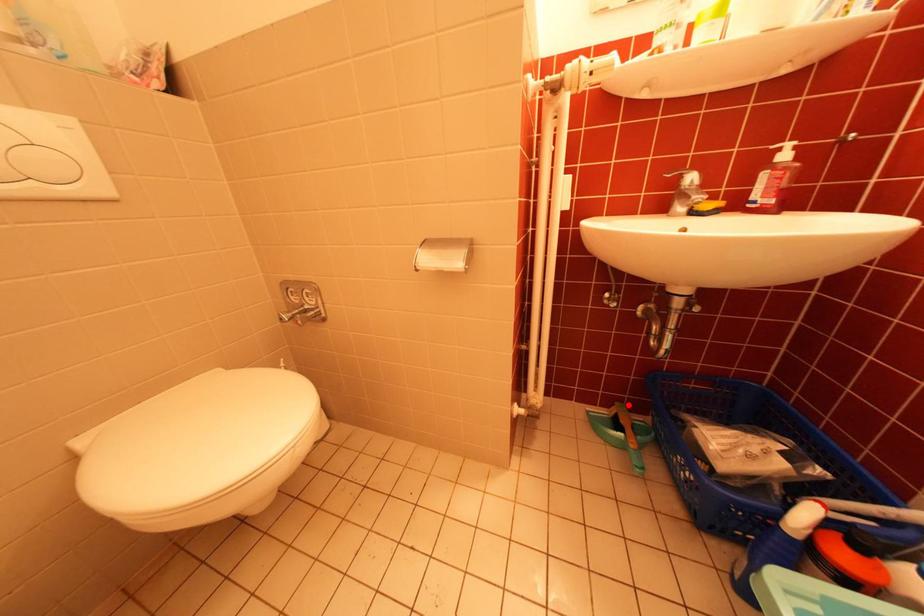
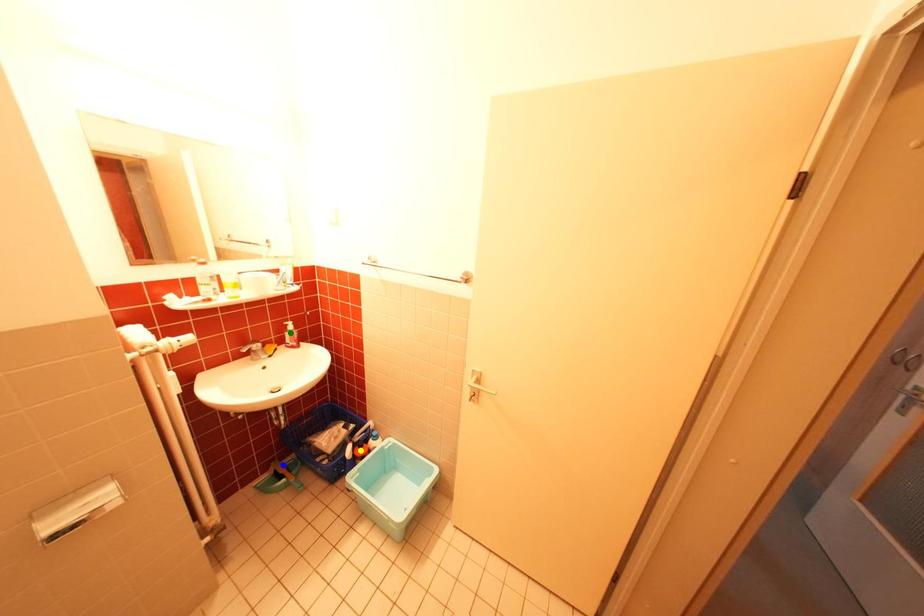
Question: I am providing you with two images of the same scene from different viewpoints. A red point is marked on the first image. You are given multiple points on the second image. Which spot in image 2 lines up with the point in image 1?

Choices:
 (A) yellow point
 (B) blue point
 (C) green point

Answer: (B)